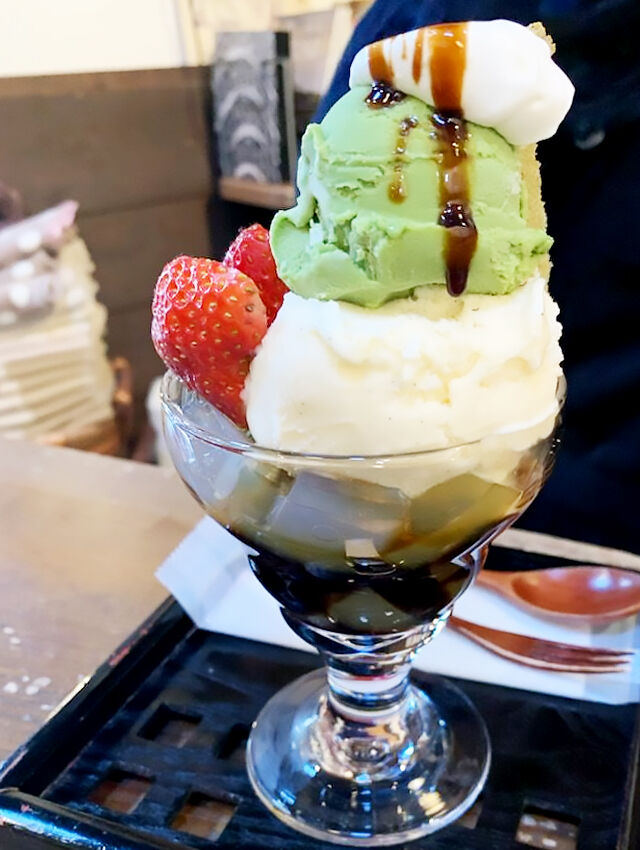
What are the coordinates of `white wall` in the screenshot? It's located at (86, 25).